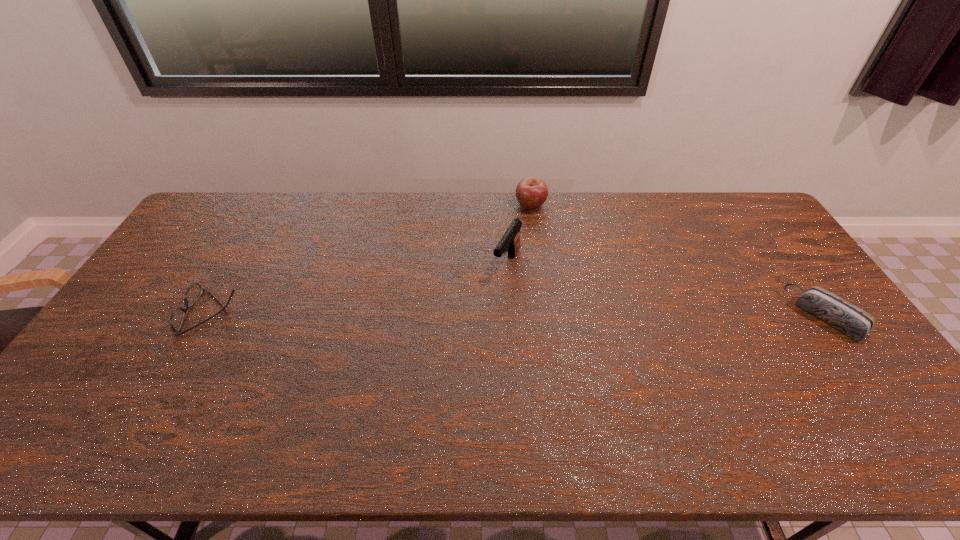
Locate an element on the screen. The image size is (960, 540). vacant point at the far edge is located at coordinates (449, 224).

Locate an element on the screen. The image size is (960, 540). vacant space at the near edge is located at coordinates (297, 385).

At what (x,y) coordinates should I click in order to perform the action: click on vacant point at the right edge. Please return your answer as a coordinate pair (x, y). This screenshot has width=960, height=540. Looking at the image, I should click on [788, 261].

The height and width of the screenshot is (540, 960). I want to click on free space between the leftmost object and the apple, so click(x=372, y=259).

Find the location of `vacant space that's between the pistol and the leftmost object`. vacant space that's between the pistol and the leftmost object is located at coordinates (359, 288).

You are a GUI agent. You are given a task and a screenshot of the screen. Output one action in this format:
    pyautogui.click(x=<x>, y=<y>)
    Task: Click on the free spot between the third shortest object and the shortest object
    
    Given the screenshot: What is the action you would take?
    pyautogui.click(x=372, y=259)

Where is `empty location between the second shortest object and the spectacles`? Image resolution: width=960 pixels, height=540 pixels. empty location between the second shortest object and the spectacles is located at coordinates (518, 314).

The image size is (960, 540). Find the location of `vacant area that lies between the apple and the pencil box`. vacant area that lies between the apple and the pencil box is located at coordinates (678, 260).

Image resolution: width=960 pixels, height=540 pixels. In order to click on free point between the leftmost object and the farthest object in this screenshot , I will do `click(372, 259)`.

Find the location of a particular element. vacant space in between the spectacles and the pencil box is located at coordinates (518, 314).